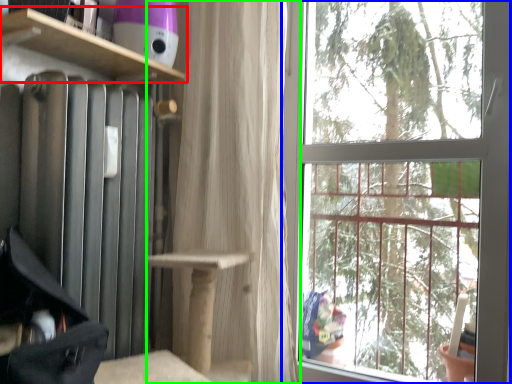
Question: Considering the real-world distances, which object is farthest from shelf (highlighted by a red box)? window (highlighted by a blue box) or curtain (highlighted by a green box)?

Choices:
 (A) window
 (B) curtain

Answer: (A)